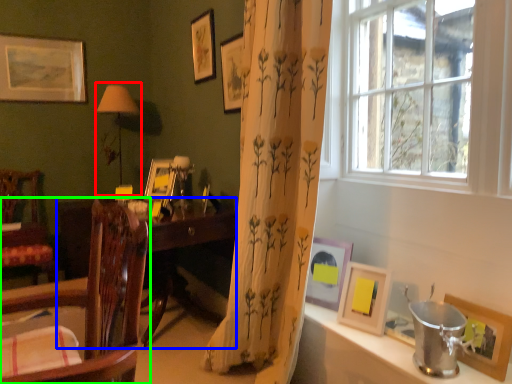
Question: Which object is positioned closest to table lamp (highlighted by a red box)? Select from desk (highlighted by a blue box) and chair (highlighted by a green box).

Choices:
 (A) desk
 (B) chair

Answer: (A)